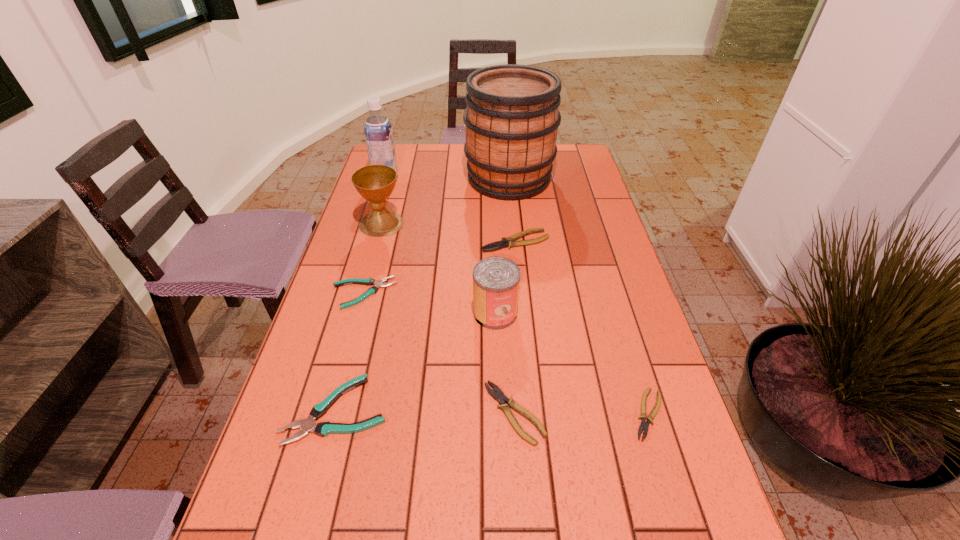
Image resolution: width=960 pixels, height=540 pixels. What are the coordinates of `the sixth closest object to the tallest pliers` in the screenshot? It's located at (499, 396).

Select which object appears as the fifth closest to the second smallest yellow pliers. Please provide its 2D coordinates. Your answer should be formatted as a tuple, i.e. [(x, y)], where the tuple contains the x and y coordinates of a point satisfying the conditions above.

[(509, 242)]

Choose which pliers is the fifth nearest neighbor to the tallest object. Please provide its 2D coordinates. Your answer should be formatted as a tuple, i.e. [(x, y)], where the tuple contains the x and y coordinates of a point satisfying the conditions above.

[(644, 425)]

Locate an element on the screen. The height and width of the screenshot is (540, 960). pliers that stands as the fourth closest to the rightmost yellow pliers is located at coordinates pyautogui.click(x=372, y=290).

Image resolution: width=960 pixels, height=540 pixels. I want to click on yellow pliers that stands as the closest to the second farthest pliers, so click(509, 242).

In order to click on yellow pliers that stands as the closest to the smaller teal pliers in this screenshot , I will do `click(509, 242)`.

Where is `teal pliers that is the second closest one to the farthest yellow pliers`? The image size is (960, 540). teal pliers that is the second closest one to the farthest yellow pliers is located at coordinates (323, 429).

The width and height of the screenshot is (960, 540). What are the coordinates of `free point that satisfies the following two spatial constraints: 1. on the front side of the can; 2. on the right side of the seventh shortest object` in the screenshot? It's located at (357, 313).

Where is `free space in the image that satisfies the following two spatial constraints: 1. on the front side of the nearer teal pliers; 2. on the left side of the second biggest yellow pliers`? free space in the image that satisfies the following two spatial constraints: 1. on the front side of the nearer teal pliers; 2. on the left side of the second biggest yellow pliers is located at coordinates (336, 413).

Locate an element on the screen. This screenshot has height=540, width=960. vacant region that satisfies the following two spatial constraints: 1. on the label of the eighth shortest object; 2. on the back side of the sixth shortest object is located at coordinates (347, 313).